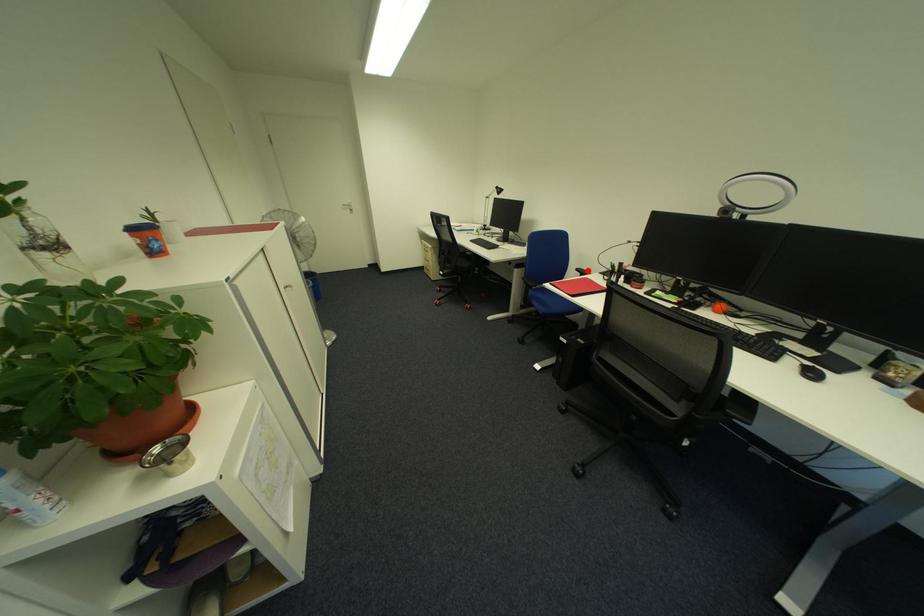
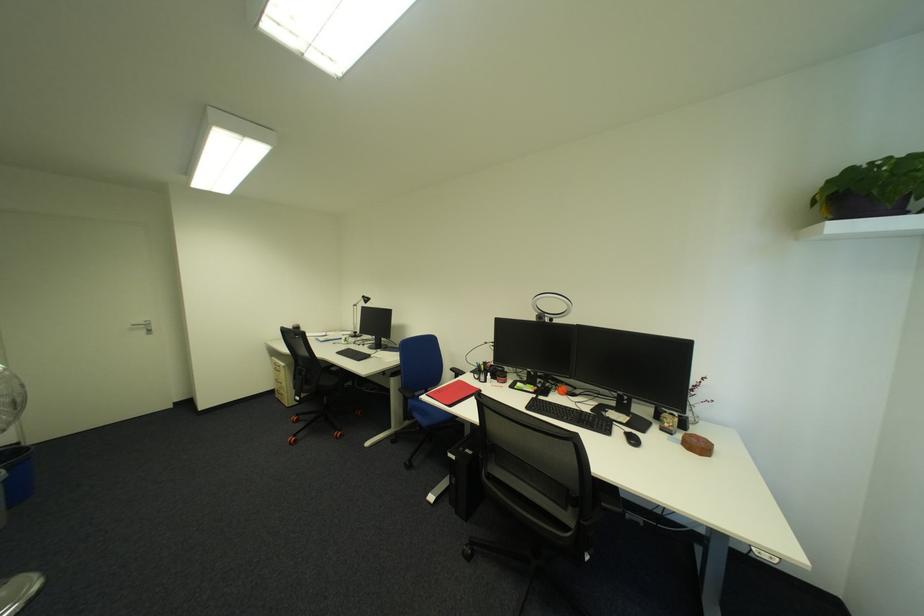
Question: I am providing you with two images of the same scene from different viewpoints. In image1, a red point is highlighted. Considering the same 3D point in image2, which of the following is correct?

Choices:
 (A) It is closer
 (B) It is farther

Answer: (B)